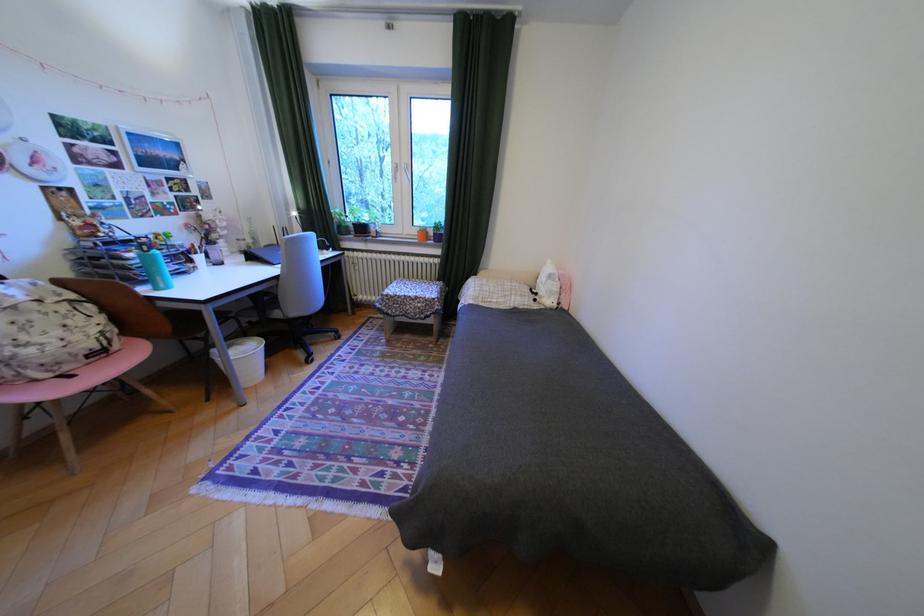
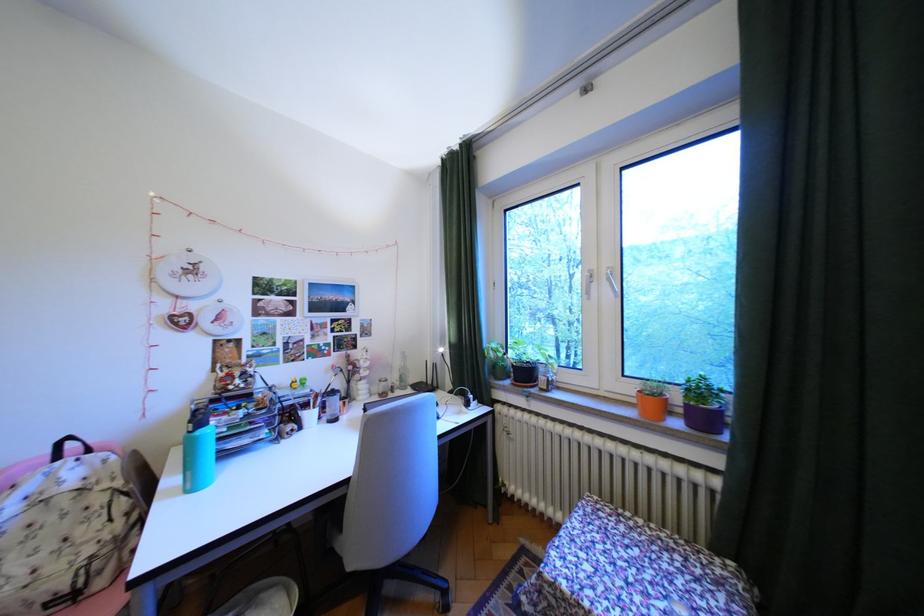
The point at (x=398, y=296) is marked in the first image. Where is the corresponding point in the second image?

(564, 585)